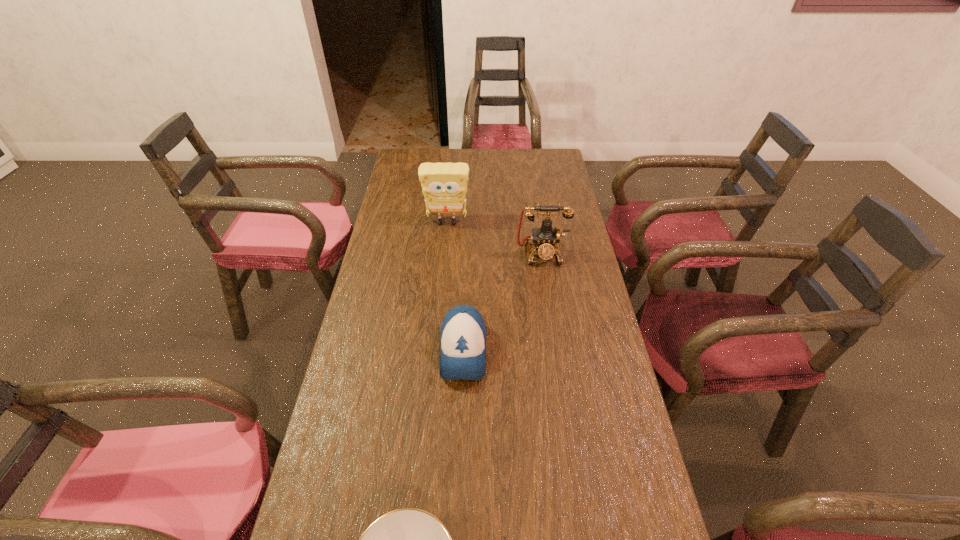
What are the coordinates of `free space between the baseball cap and the sponge` in the screenshot? It's located at (455, 287).

Locate an element on the screen. object that is the closest to the nearest object is located at coordinates (463, 333).

You are a GUI agent. You are given a task and a screenshot of the screen. Output one action in this format:
    pyautogui.click(x=<x>, y=<y>)
    Task: Click on the object that is the closest to the second farthest object
    The height and width of the screenshot is (540, 960).
    Given the screenshot: What is the action you would take?
    pyautogui.click(x=444, y=185)